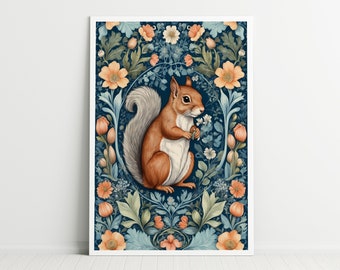
Identify the location of white wall. (276, 198).